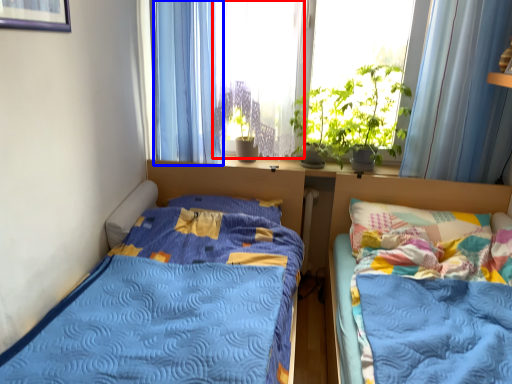
Question: Which object is further to the camera taking this photo, window screen (highlighted by a red box) or curtain (highlighted by a blue box)?

Choices:
 (A) window screen
 (B) curtain

Answer: (B)